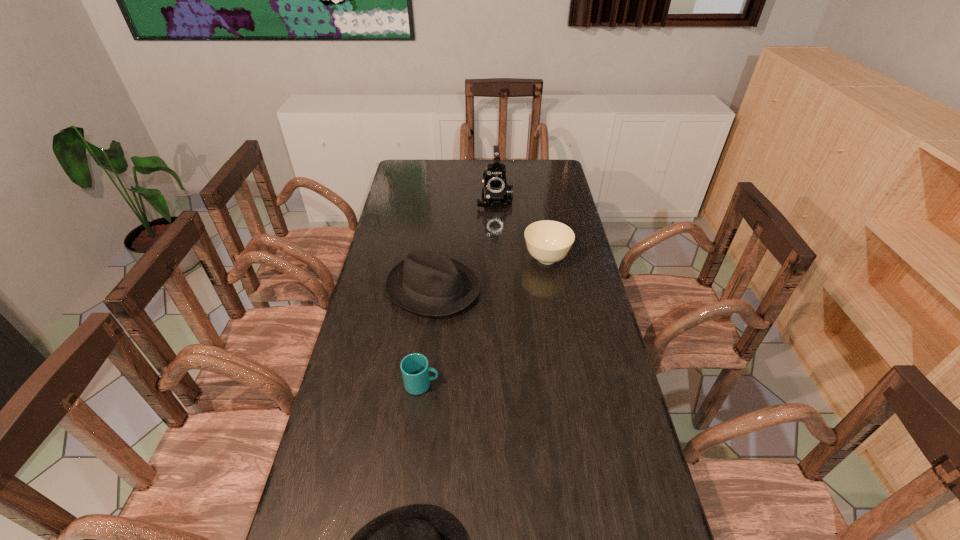
Locate an element on the screen. camcorder is located at coordinates (496, 192).

The image size is (960, 540). I want to click on the tallest object, so click(496, 192).

The image size is (960, 540). I want to click on the farther fedora, so click(427, 281).

In order to click on the second tallest object in this screenshot , I will do `click(427, 281)`.

You are a GUI agent. You are given a task and a screenshot of the screen. Output one action in this format:
    pyautogui.click(x=<x>, y=<y>)
    Task: Click on the third tallest object
    The width and height of the screenshot is (960, 540).
    Given the screenshot: What is the action you would take?
    pyautogui.click(x=547, y=241)

The height and width of the screenshot is (540, 960). In order to click on sugar bowl in this screenshot , I will do `click(547, 241)`.

This screenshot has width=960, height=540. What are the coordinates of `the second nearest object` in the screenshot? It's located at (415, 369).

You are a GUI agent. You are given a task and a screenshot of the screen. Output one action in this format:
    pyautogui.click(x=<x>, y=<y>)
    Task: Click on the free location located 0.200m on the lens mount of the tallest object
    
    Given the screenshot: What is the action you would take?
    pyautogui.click(x=496, y=239)

The width and height of the screenshot is (960, 540). In order to click on vacant space located on the back of the taller fedora in this screenshot , I will do `click(439, 238)`.

Where is `vacant area situated on the back of the third shortest object`? This screenshot has width=960, height=540. vacant area situated on the back of the third shortest object is located at coordinates (537, 201).